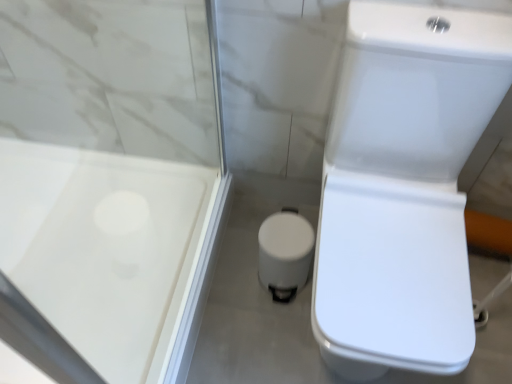
Question: From their relative heights in the image, would you say white glossy trash can at center is taller or shorter than white glossy toilet at right?

Choices:
 (A) tall
 (B) short

Answer: (B)

Question: Considering the positions of point (304, 235) and point (454, 264), is point (304, 235) closer or farther from the camera than point (454, 264)?

Choices:
 (A) farther
 (B) closer

Answer: (A)

Question: Which of these objects is positioned closest to the transparent plastic screen door at upper left?

Choices:
 (A) white glossy toilet at right
 (B) white glossy trash can at center

Answer: (B)

Question: Which object is the farthest from the white glossy trash can at center?

Choices:
 (A) white glossy toilet at right
 (B) transparent plastic screen door at upper left

Answer: (B)